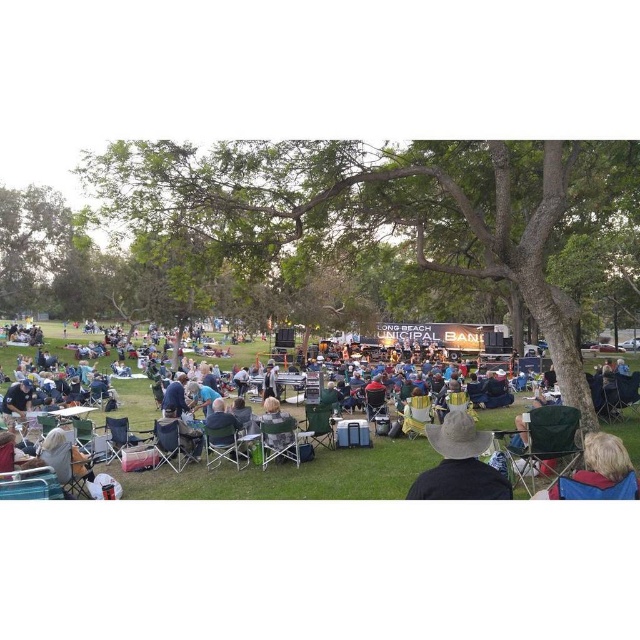
Question: Which point is farther to the camera?

Choices:
 (A) dark blue fabric chair at center
 (B) brown straw hat at center

Answer: (A)

Question: Which point appears farthest from the camera in this image?

Choices:
 (A) (150, 413)
 (B) (458, 496)

Answer: (A)

Question: Is dark blue fabric chair at center thinner than brown straw hat at center?

Choices:
 (A) yes
 (B) no

Answer: (B)

Question: From the image, what is the correct spatial relationship of dark blue fabric chair at center in relation to brown straw hat at center?

Choices:
 (A) below
 (B) above

Answer: (B)

Question: Which point is closer to the camera?

Choices:
 (A) brown straw hat at center
 (B) dark blue fabric chair at center

Answer: (A)

Question: Does dark blue fabric chair at center have a smaller size compared to brown straw hat at center?

Choices:
 (A) no
 (B) yes

Answer: (A)